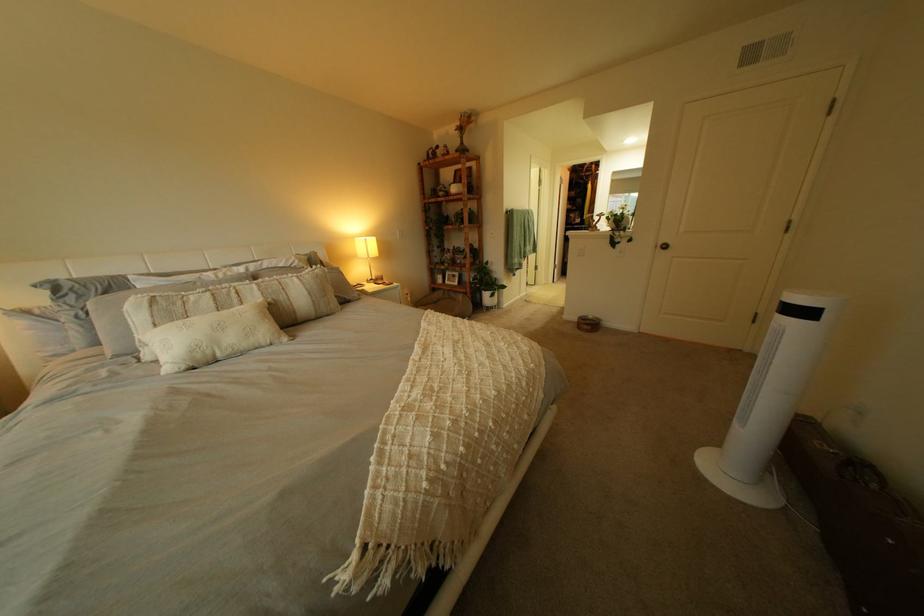
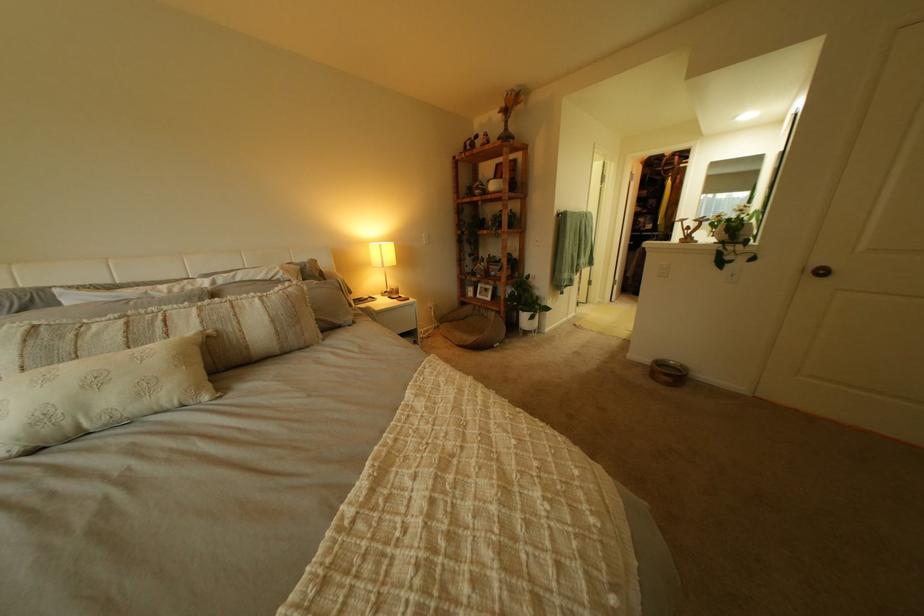
Question: The images are taken continuously from a first-person perspective. In which direction are you moving?

Choices:
 (A) Left
 (B) Right
 (C) Forward
 (D) Backward

Answer: (C)